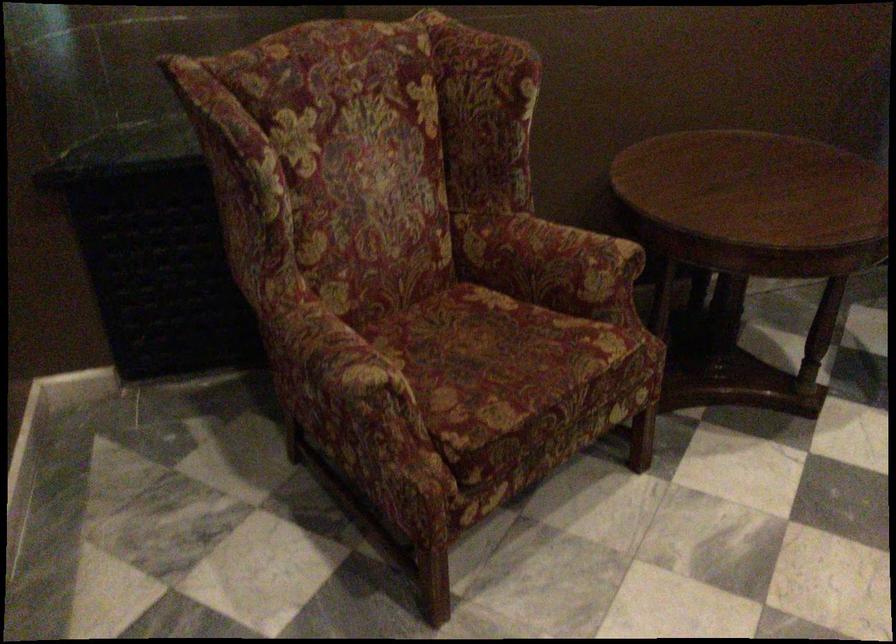
Locate an element on the screen. This screenshot has height=644, width=896. chair sitting surface is located at coordinates (495, 363).